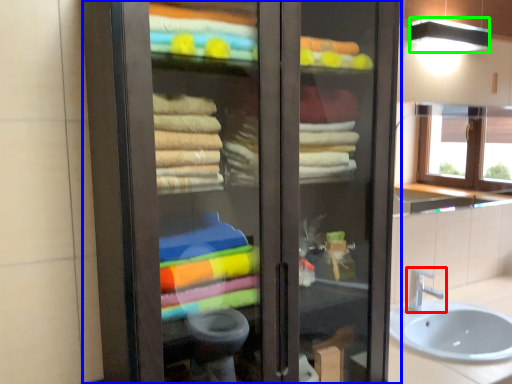
Question: Which object is the farthest from tap (highlighted by a red box)? Choose among these: bathroom cabinet (highlighted by a blue box) or shower (highlighted by a green box).

Choices:
 (A) bathroom cabinet
 (B) shower

Answer: (A)